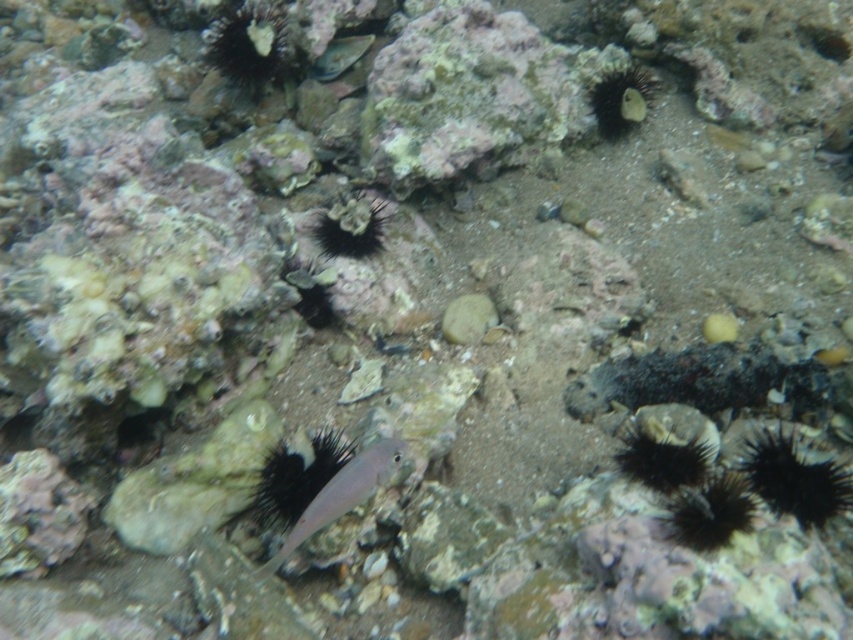
Question: Considering the real-world distances, which object is farthest from the black spiny coral at center?

Choices:
 (A) pink translucent fish at center
 (B) smooth black sea urchin at upper right
 (C) smooth white coral at upper center

Answer: (B)

Question: Which point is closer to the camera?

Choices:
 (A) (368, 250)
 (B) (643, 104)
 (C) (395, 468)
 (D) (206, 33)

Answer: (C)

Question: Is black spiny coral at center positioned in front of shiny silver fish at upper center?

Choices:
 (A) yes
 (B) no

Answer: (A)

Question: In this image, where is smooth white coral at upper center located relative to pink translucent fish at center?

Choices:
 (A) above
 (B) below

Answer: (A)

Question: Which object appears farthest from the camera in this image?

Choices:
 (A) black spiny coral at center
 (B) shiny silver fish at upper center
 (C) smooth black sea urchin at upper right

Answer: (B)

Question: Does smooth black sea urchin at upper right appear on the left side of shiny silver fish at upper center?

Choices:
 (A) yes
 (B) no

Answer: (B)